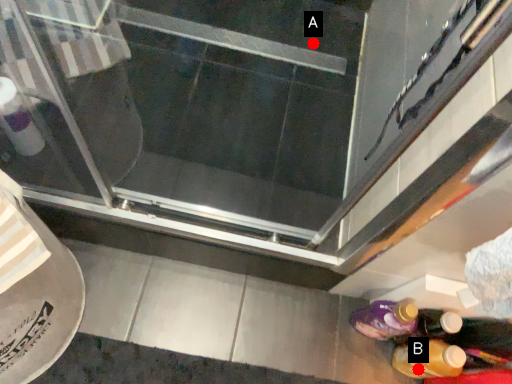
Question: Two points are circled on the image, labeled by A and B beside each circle. Which point is closer to the camera taking this photo?

Choices:
 (A) A is closer
 (B) B is closer

Answer: (B)